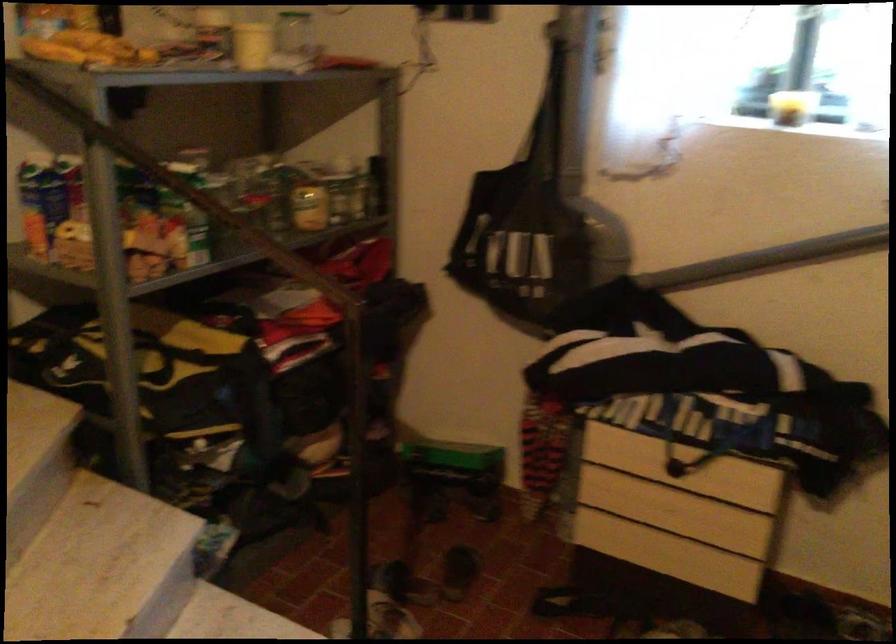
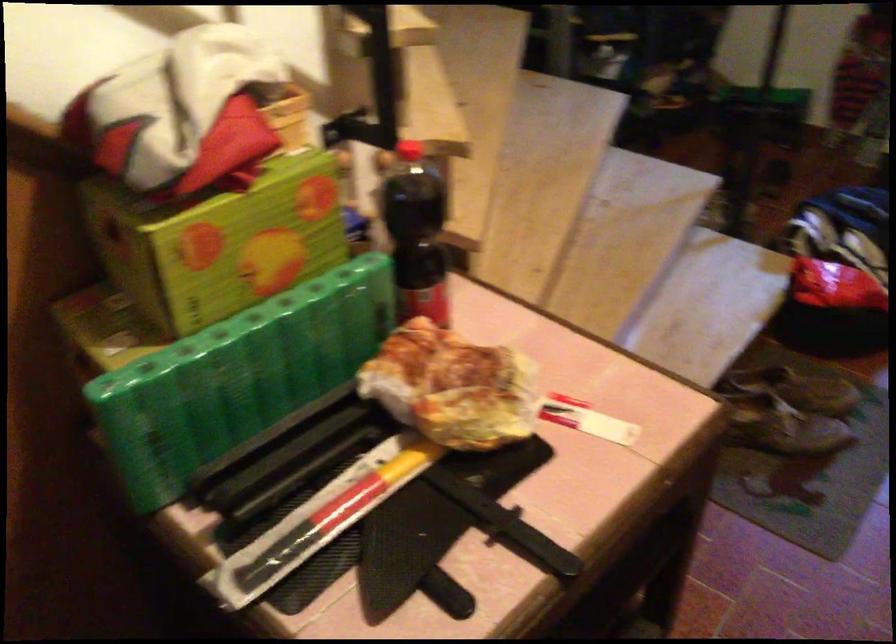
Consider the image. Based on the continuous images, in which direction is the camera rotating?

The rotation direction of the camera is left-down.